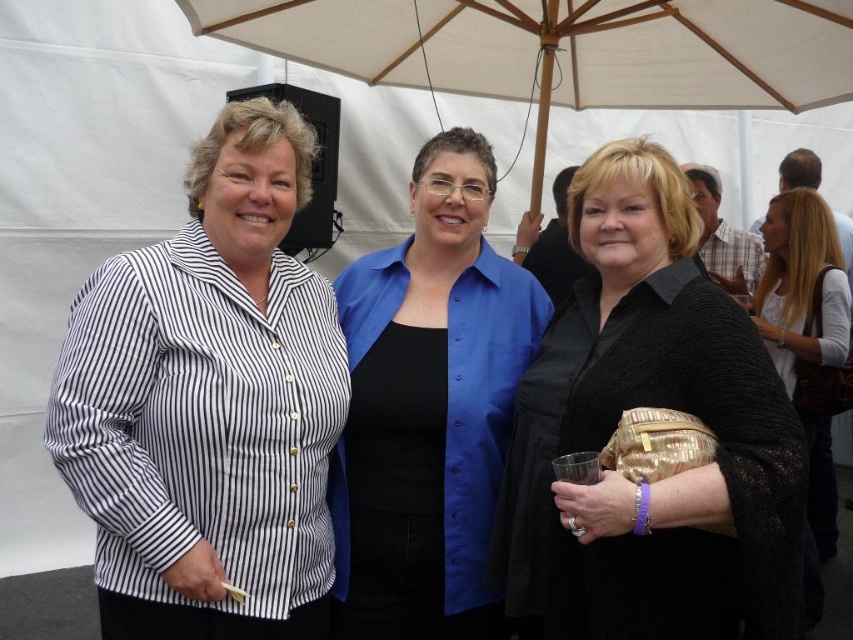
You are standing at the event and want to take a photo of the three women under the white fabric umbrella at upper center. Considering the distance, can you capture all three women in one frame without moving closer or further away?

The white fabric umbrella at upper center is 2.92 meters from the viewer. Since the umbrella is the central point under which all three women are standing closely together, capturing them in one frame at this distance should be feasible as they are positioned closely under the umbrella.

You are at the event and want to locate the white striped shirt at center. According to the coordinates provided, where would you look?

You should look at point 0.631 on the x axis and 0.246 on the y axis to find the white striped shirt at center.